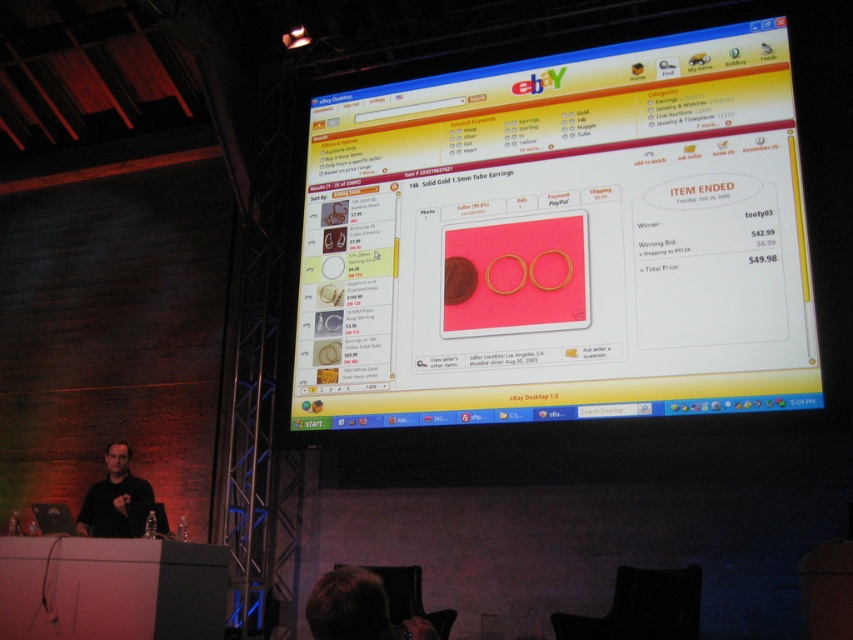
You are an attendee at a jewelry presentation and see the screen showing the eBay listing for the gold earrings. The presenter is wearing the pink matte earrings at center and a black matte shirt at lower left. Which item on the presenter is taller?

The pink matte earrings at center is much taller as the black matte shirt at lower left.

You are a photographer capturing a closeup of the presenter. The dark brown hair at lower center and the black matte shirt at lower left are in your view. Which object is covering the other?

The dark brown hair at lower center is positioned over black matte shirt at lower left, so it is covering the black matte shirt at lower left.